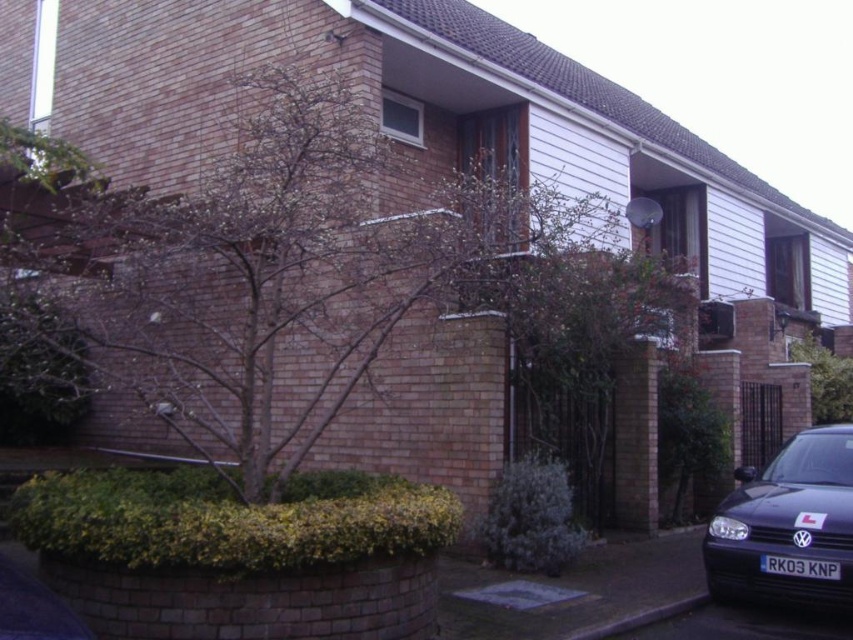
Question: Among these objects, which one is farthest from the camera?

Choices:
 (A) green leafy tree at center
 (B) black plastic license plate at lower right
 (C) matte black car at lower right

Answer: (A)

Question: Can you confirm if matte black car at lower right is smaller than green leafy tree at center?

Choices:
 (A) no
 (B) yes

Answer: (B)

Question: Can you confirm if green leafy tree at center is thinner than black plastic license plate at lower right?

Choices:
 (A) no
 (B) yes

Answer: (A)

Question: Which point is farther to the camera?

Choices:
 (A) (785, 564)
 (B) (817, 532)
 (C) (811, 348)

Answer: (C)

Question: Does matte black car at lower right appear on the left side of black plastic license plate at lower right?

Choices:
 (A) no
 (B) yes

Answer: (A)

Question: Which point is closer to the camera?

Choices:
 (A) black plastic license plate at lower right
 (B) green leafy tree at center
 (C) matte black car at lower right

Answer: (C)